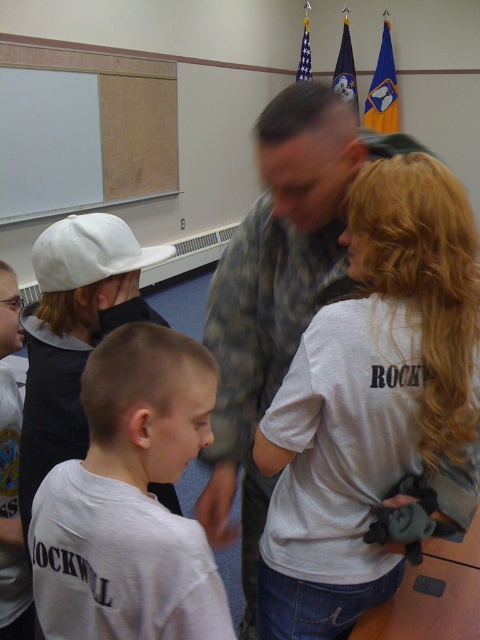
Question: Which point is farther to the camera?

Choices:
 (A) (295, 113)
 (B) (135, 252)

Answer: (B)

Question: Can you confirm if white cotton shirt at center is positioned below white matte shirt at center?

Choices:
 (A) yes
 (B) no

Answer: (B)

Question: Which object appears closest to the camera in this image?

Choices:
 (A) camouflage uniform at center
 (B) white matte shirt at center
 (C) white matte baseball cap at left

Answer: (B)

Question: Is white matte shirt at center to the left of white matte baseball cap at left from the viewer's perspective?

Choices:
 (A) no
 (B) yes

Answer: (A)

Question: Does white matte shirt at center have a lesser width compared to whiteboard at upper left?

Choices:
 (A) yes
 (B) no

Answer: (A)

Question: Based on their relative distances, which object is nearer to the white matte shirt at center?

Choices:
 (A) white matte baseball cap at left
 (B) whiteboard at upper left
 (C) camouflage uniform at center

Answer: (A)